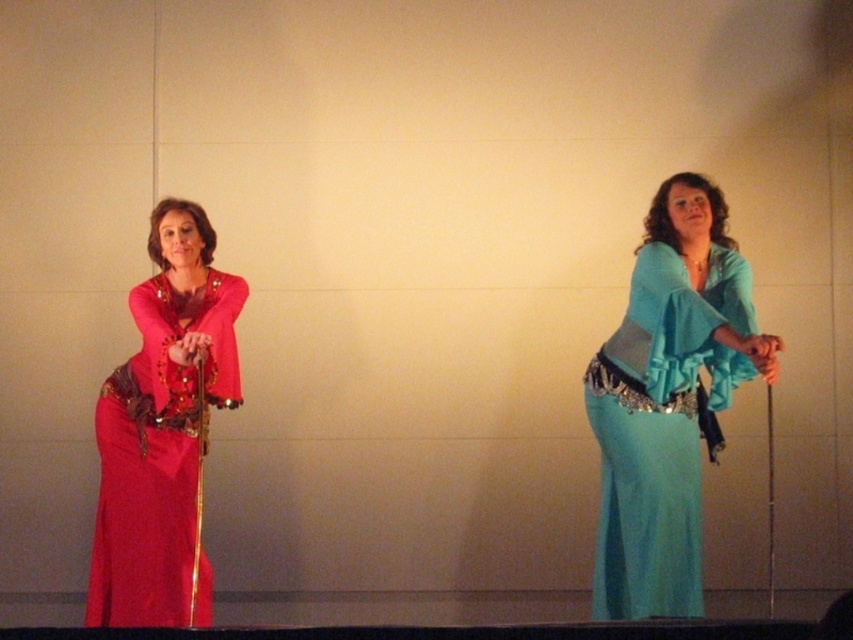
You are a photographer setting up a camera at point 0.5, 0.5 in the image coordinate system. You need to focus on the teal satin dress at right. What is the direction you should adjust the camera to face?

The teal satin dress at right is located at point [668,401], which is northeast of the camera position at [426,320]. Therefore, the camera should be adjusted to face northeast to focus on the teal satin dress at right.

You are a photographer setting up for a photoshoot. You need to position a spotlight so that it illuminates both the teal satin dress at right and the matte red dress at left equally. Considering their heights, which dress requires the spotlight to be placed higher to ensure proper lighting?

The teal satin dress at right is much taller than the matte red dress at left, so the spotlight should be placed higher to properly illuminate the taller teal satin dress at right.

Based on the photo, you are a photographer setting up for a photoshoot. You need to position two models wearing the teal satin dress at right and the matte red dress at left. According to the scene description, which model should stand to the left of the other?

The matte red dress at left should be positioned to the left of the teal satin dress at right because the teal satin dress at right is to the right of the matte red dress at left.